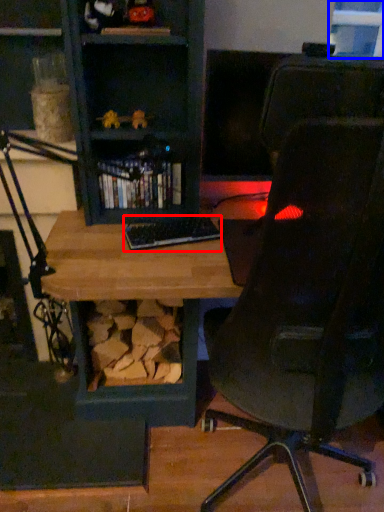
Question: Which of the following is the closest to the observer, keyboard (highlighted by a red box) or window (highlighted by a blue box)?

Choices:
 (A) keyboard
 (B) window

Answer: (A)